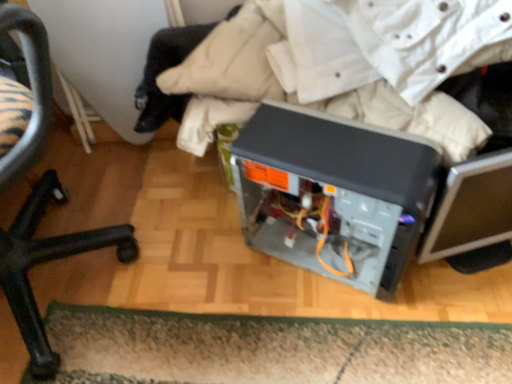
This screenshot has height=384, width=512. I want to click on free spot below black plastic chair at lower left (from a real-world perspective), so click(71, 268).